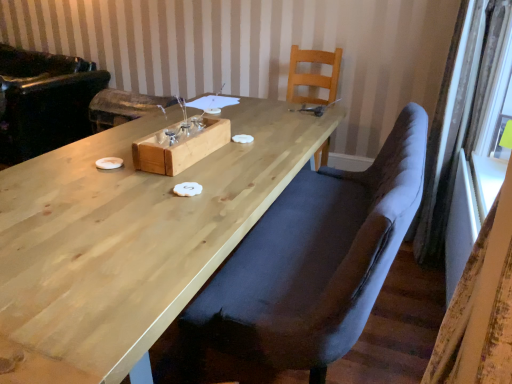
At what (x,y) coordinates should I click in order to perform the action: click on vacant area on top of natural wood table at center (from a real-world perspective). Please return your answer as a coordinate pair (x, y). This screenshot has height=384, width=512. Looking at the image, I should click on (181, 177).